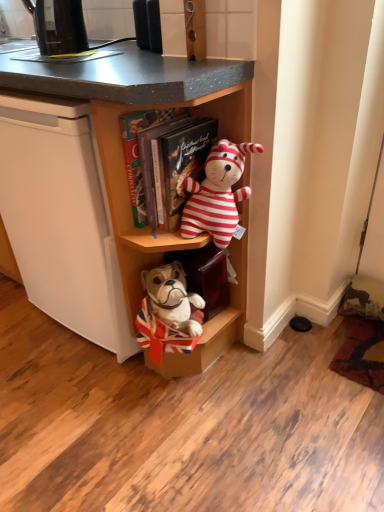
Question: Is striped plush toy at center taller or shorter than black plastic kettle at upper left?

Choices:
 (A) tall
 (B) short

Answer: (A)

Question: From a real-world perspective, relative to black plastic kettle at upper left, is striped plush toy at center vertically above or below?

Choices:
 (A) above
 (B) below

Answer: (B)

Question: Which object is the closest to the wooden bookshelf at center?

Choices:
 (A) striped plush toy at center
 (B) black plastic kettle at upper left
 (C) wooden cabinet at center

Answer: (C)

Question: Estimate the real-world distances between objects in this image. Which object is closer to the black plastic kettle at upper left?

Choices:
 (A) striped plush toy at center
 (B) wooden cabinet at center
 (C) wooden bookshelf at center

Answer: (B)